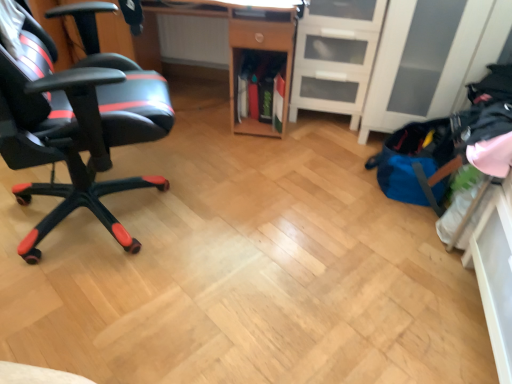
Question: Choose the correct answer: Is wooden desk at center inside black matte gaming chair at left or outside it?

Choices:
 (A) outside
 (B) inside

Answer: (A)

Question: In terms of width, does wooden desk at center look wider or thinner when compared to black matte gaming chair at left?

Choices:
 (A) wide
 (B) thin

Answer: (B)

Question: Which is farther from the wooden desk at center?

Choices:
 (A) black matte gaming chair at left
 (B) white matte file cabinet at center right

Answer: (A)

Question: Considering the real-world distances, which object is closest to the black matte gaming chair at left?

Choices:
 (A) white matte file cabinet at center right
 (B) wooden desk at center

Answer: (B)